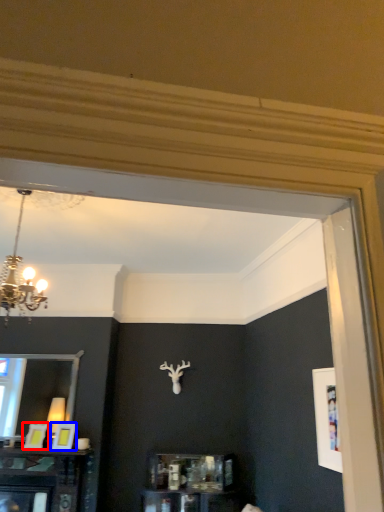
Question: Which object is further to the camera taking this photo, picture frame (highlighted by a red box) or picture frame (highlighted by a blue box)?

Choices:
 (A) picture frame
 (B) picture frame

Answer: (A)